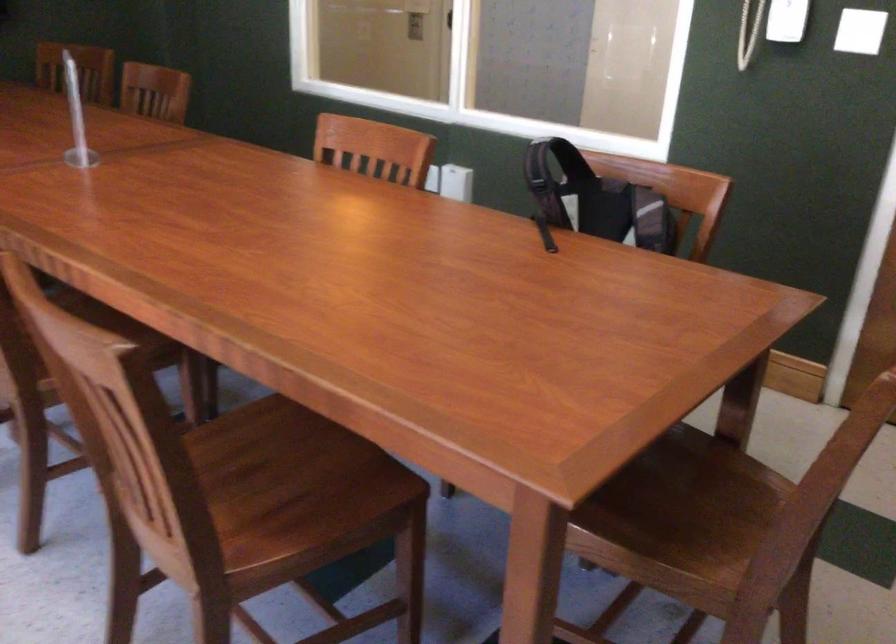
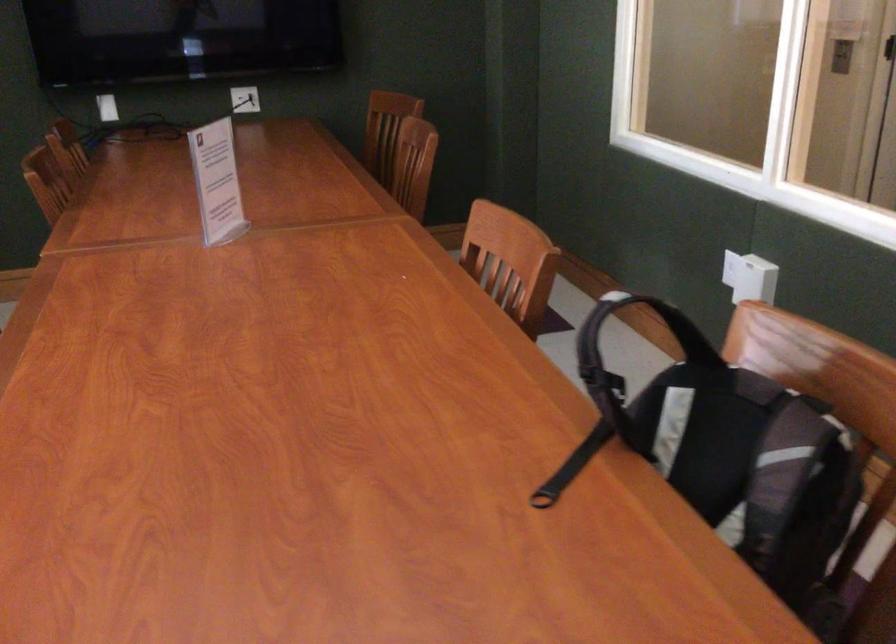
The point at (446, 169) is marked in the first image. Where is the corresponding point in the second image?

(742, 269)